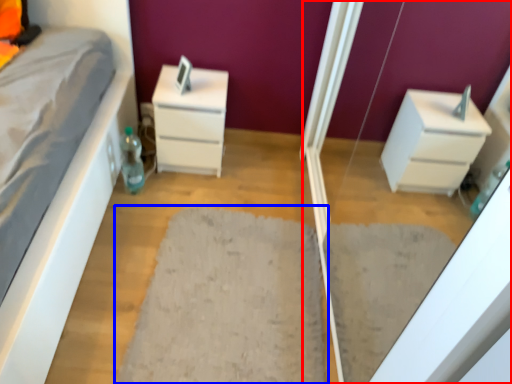
Question: Which object appears closest to the camera in this image, screen door (highlighted by a red box) or doormat (highlighted by a blue box)?

Choices:
 (A) screen door
 (B) doormat

Answer: (A)